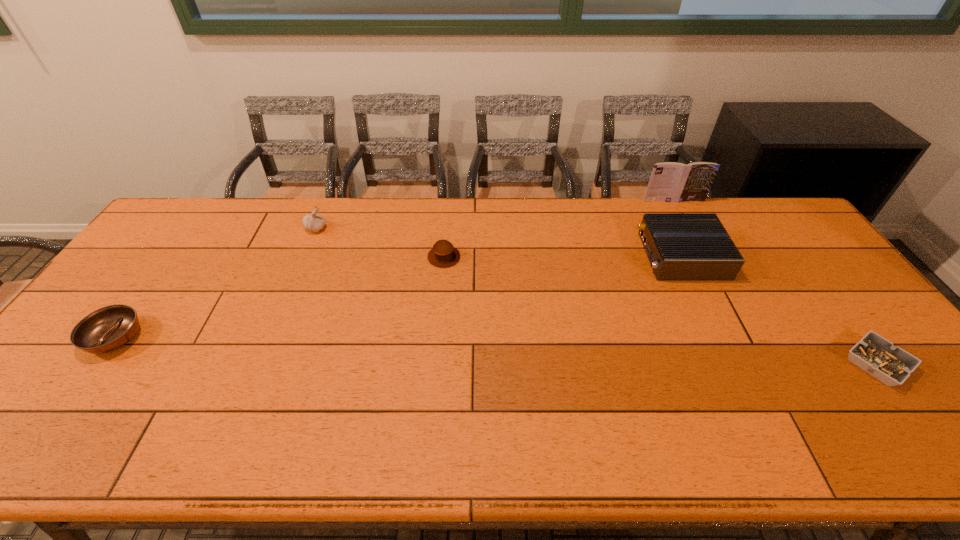
Identify the location of unoccupied position between the router and the muffin. This screenshot has width=960, height=540. (563, 256).

Locate an element on the screen. unoccupied position between the third object from left to right and the shortest object is located at coordinates coord(660,310).

Locate an element on the screen. This screenshot has height=540, width=960. free space between the leftmost object and the router is located at coordinates (398, 296).

What are the coordinates of `empty location between the leftmost object and the fourth object from right to left` in the screenshot? It's located at (279, 297).

Locate an element on the screen. The width and height of the screenshot is (960, 540). empty location between the fifth tallest object and the rightmost object is located at coordinates (495, 351).

You are a GUI agent. You are given a task and a screenshot of the screen. Output one action in this format:
    pyautogui.click(x=<x>, y=<y>)
    Task: Click on the third closest object to the rightmost object
    Image resolution: width=960 pixels, height=540 pixels.
    Given the screenshot: What is the action you would take?
    pyautogui.click(x=443, y=254)

This screenshot has height=540, width=960. I want to click on object that is the closest to the rightmost object, so click(679, 246).

Where is `vacant space that satisfies the following two spatial constraints: 1. on the back panel of the router; 2. on the back side of the shortest object`? The image size is (960, 540). vacant space that satisfies the following two spatial constraints: 1. on the back panel of the router; 2. on the back side of the shortest object is located at coordinates (734, 364).

Where is `vacant space that satisfies the following two spatial constraints: 1. on the back side of the shortest object; 2. on the back panel of the router`? vacant space that satisfies the following two spatial constraints: 1. on the back side of the shortest object; 2. on the back panel of the router is located at coordinates (796, 256).